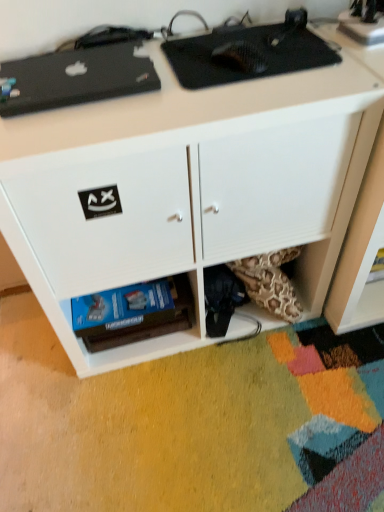
Locate an element on the screen. Image resolution: width=384 pixels, height=512 pixels. free spot above white matte desk at upper center (from a real-world perspective) is located at coordinates (192, 77).